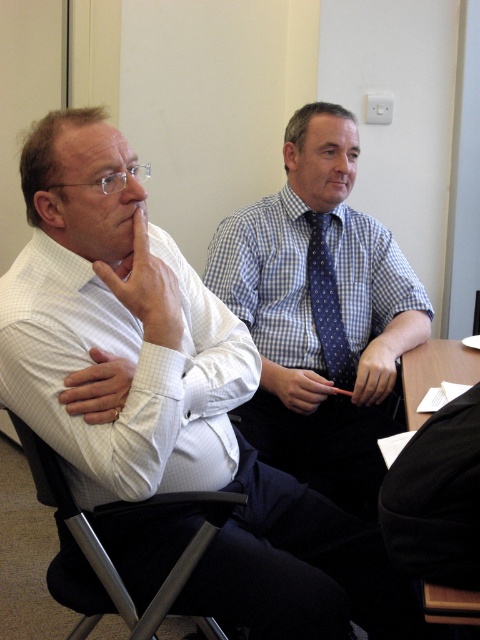
You are organizing a clothing donation drive and need to determine which item occupies more space when folded. Based on the image, which object between the blue checkered shirt at center and the black fabric at lower right is wider?

The blue checkered shirt at center is wider than the black fabric at lower right according to the description.

Based on the photo, you are a photographer preparing to take a portrait of the person wearing the blue dotted fabric tie at center. You have a camera that requires a minimum distance of 2 meters to focus properly. Can you position yourself at the camera to capture the subject clearly?

The blue dotted fabric tie at center and camera are 1.97 meters apart, which is less than the required 2 meters. Therefore, the camera cannot focus properly at this distance.

Based on the coordinates provided, which object corresponds to the point at (167,392)?

The point at (167,392) corresponds to the white checkered shirt at left.